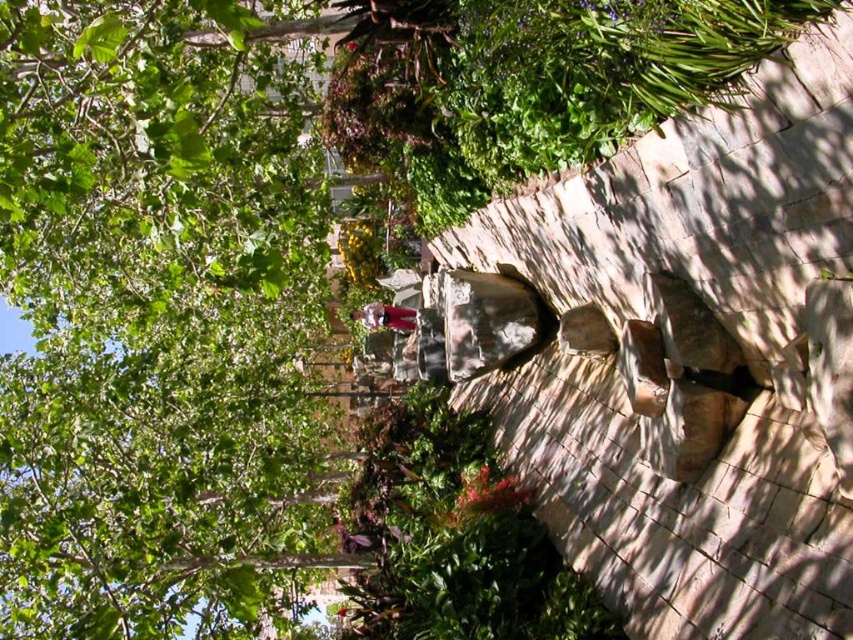
Does green leafy tree at upper left have a lesser height compared to natural stone rock face at center?

No.

Does green leafy tree at upper left have a greater height compared to natural stone rock face at center?

Indeed, green leafy tree at upper left has a greater height compared to natural stone rock face at center.

The image size is (853, 640). In order to click on green leafy tree at upper left in this screenshot , I will do `click(148, 300)`.

Locate an element on the screen. The height and width of the screenshot is (640, 853). green leafy tree at upper left is located at coordinates (148, 300).

Between natural stone rock face at center and matte purple dress at center, which one is positioned higher?

matte purple dress at center is above.

Which of these two, natural stone rock face at center or matte purple dress at center, stands taller?

With more height is natural stone rock face at center.

Describe the element at coordinates (689, 358) in the screenshot. The image size is (853, 640). I see `natural stone rock face at center` at that location.

Where is `natural stone rock face at center`? Image resolution: width=853 pixels, height=640 pixels. natural stone rock face at center is located at coordinates (689, 358).

Is green leafy tree at upper left closer to camera compared to matte purple dress at center?

Yes, green leafy tree at upper left is in front of matte purple dress at center.

Does green leafy tree at upper left have a lesser height compared to matte purple dress at center?

In fact, green leafy tree at upper left may be taller than matte purple dress at center.

Does point (45, 129) come closer to viewer compared to point (372, 324)?

Yes, it is.

Locate an element on the screen. The image size is (853, 640). green leafy tree at upper left is located at coordinates (x=148, y=300).